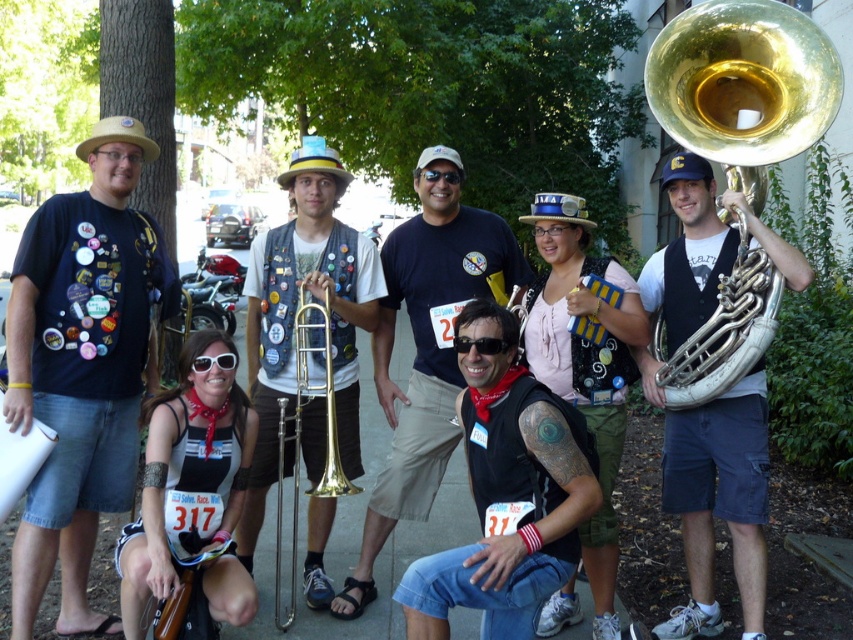
Question: Does matte black t-shirt at left appear on the right side of shiny brass trombone at center?

Choices:
 (A) yes
 (B) no

Answer: (B)

Question: Estimate the real-world distances between objects in this image. Which object is farther from the brown wood trombone at lower left?

Choices:
 (A) gold brass tuba at right
 (B) gold brass trombone at center
 (C) shiny brass trombone at center

Answer: (A)

Question: Is matte black t-shirt at left smaller than black t-shirt at center?

Choices:
 (A) yes
 (B) no

Answer: (A)

Question: From the image, what is the correct spatial relationship of gold brass trombone at center in relation to brown wood trombone at lower left?

Choices:
 (A) left
 (B) right

Answer: (B)

Question: Which point is closer to the camera?

Choices:
 (A) (306, 392)
 (B) (53, 340)

Answer: (B)

Question: Among these objects, which one is farthest from the camera?

Choices:
 (A) matte black t-shirt at left
 (B) shiny brass trombone at center
 (C) silver metallic tuba at center

Answer: (B)